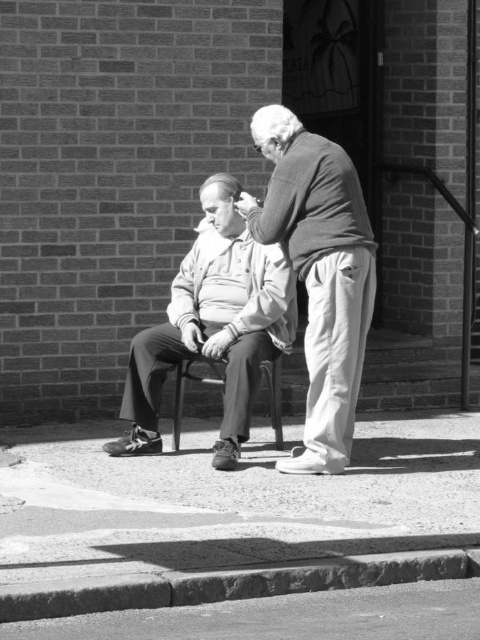
Who is lower down, smooth concrete pavement at lower center or smooth concrete curb at lower center?

smooth concrete curb at lower center

Is point (239, 525) behind point (340, 560)?

Yes.

Is point (365, 618) positioned behind point (257, 570)?

No, it is in front of (257, 570).

Where is `smooth concrete pavement at lower center`? smooth concrete pavement at lower center is located at coordinates (245, 540).

Is point (1, 513) positioned behind point (165, 365)?

That is False.

Can you confirm if smooth concrete pavement at lower center is positioned to the left of smooth gray sweater at center?

Incorrect, smooth concrete pavement at lower center is not on the left side of smooth gray sweater at center.

The height and width of the screenshot is (640, 480). Identify the location of smooth concrete pavement at lower center. (245, 540).

Which is behind, point (255, 284) or point (262, 371)?

Positioned behind is point (262, 371).

Looking at this image, does smooth gray sweater at center have a smaller size compared to metallic black chair at center?

Actually, smooth gray sweater at center might be larger than metallic black chair at center.

Does point (262, 323) lie behind point (177, 387)?

No, it is not.

Where is `smooth gray sweater at center`? smooth gray sweater at center is located at coordinates (213, 324).